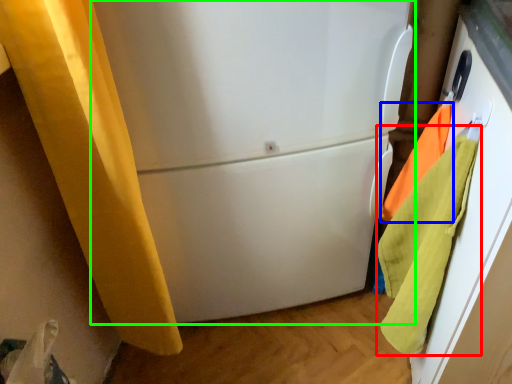
Question: Which object is positioned farthest from beach towel (highlighted by a red box)? Select from beach towel (highlighted by a blue box) and refrigerator (highlighted by a green box).

Choices:
 (A) beach towel
 (B) refrigerator

Answer: (B)